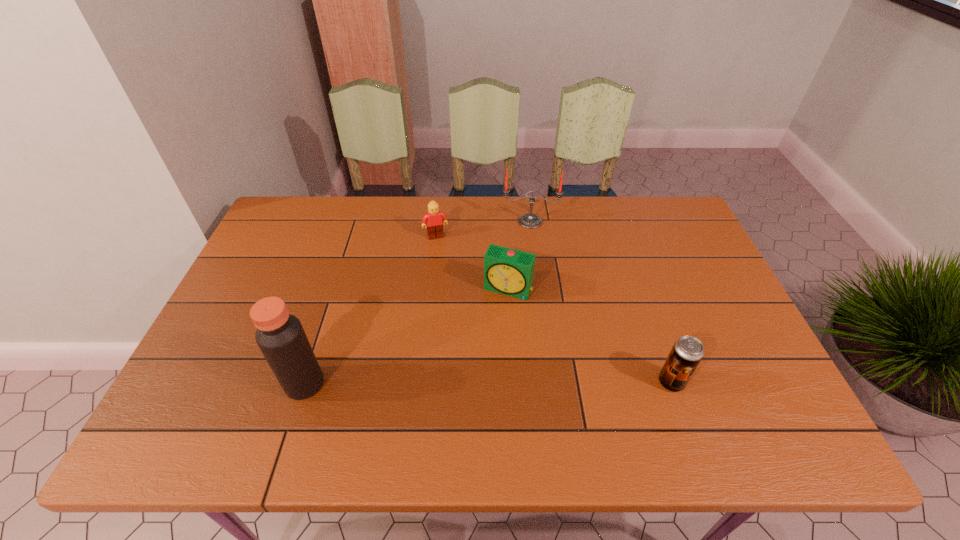
Find the location of a particular element. Image resolution: width=960 pixels, height=540 pixels. the leftmost object is located at coordinates (280, 336).

Where is `the tallest object`? the tallest object is located at coordinates (280, 336).

Find the location of `the rightmost object`. the rightmost object is located at coordinates (687, 351).

Locate an element on the screen. This screenshot has width=960, height=540. the fourth nearest object is located at coordinates (433, 219).

Find the location of `the fourth object from right to left`. the fourth object from right to left is located at coordinates (433, 219).

This screenshot has height=540, width=960. I want to click on the third farthest object, so click(507, 271).

You are a GUI agent. You are given a task and a screenshot of the screen. Output one action in this format:
    pyautogui.click(x=<x>, y=<y>)
    Task: Click on the farthest object
    This screenshot has width=960, height=540.
    Given the screenshot: What is the action you would take?
    pyautogui.click(x=530, y=221)

In order to click on candle in this screenshot , I will do `click(530, 221)`.

This screenshot has height=540, width=960. In order to click on vacant space located 0.060m on the back of the vinegar in this screenshot , I will do `click(317, 347)`.

Where is `free space located 0.250m on the left of the beer can`? The width and height of the screenshot is (960, 540). free space located 0.250m on the left of the beer can is located at coordinates (550, 382).